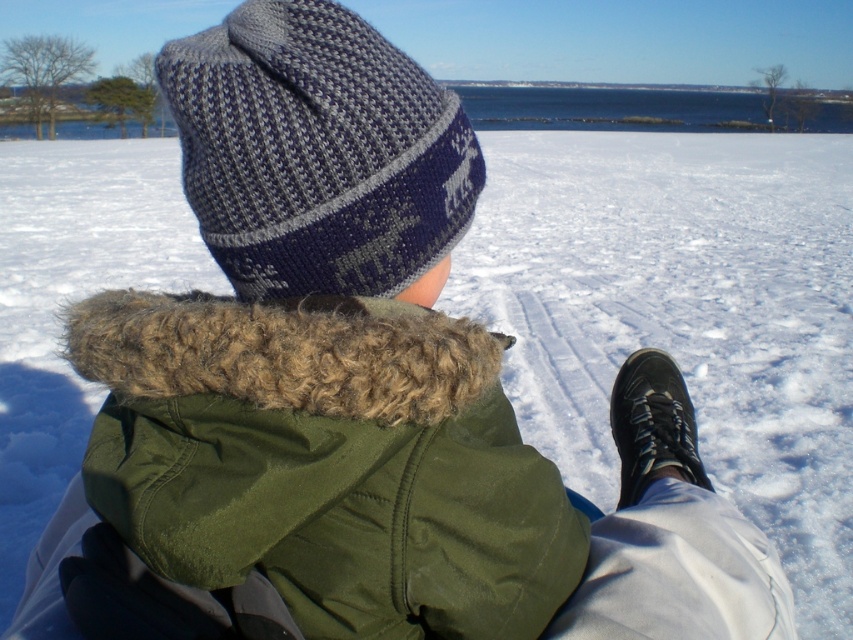
Is point (480, 417) more distant than point (416, 170)?

Yes, point (480, 417) is behind point (416, 170).

Does point (368, 314) lie in front of point (254, 268)?

Yes, point (368, 314) is in front of point (254, 268).

At what (x,y) coordinates should I click in order to perform the action: click on olive green fabric jacket at center. Please return your answer as a coordinate pair (x, y). The height and width of the screenshot is (640, 853). Looking at the image, I should click on (325, 461).